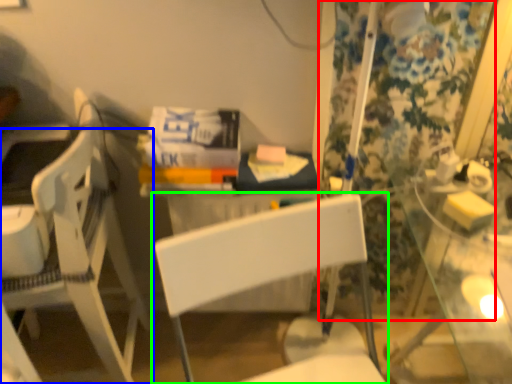
Question: Which object is positioned closest to curtain (highlighted by a red box)? Select from chair (highlighted by a blue box) and chair (highlighted by a green box).

Choices:
 (A) chair
 (B) chair

Answer: (B)